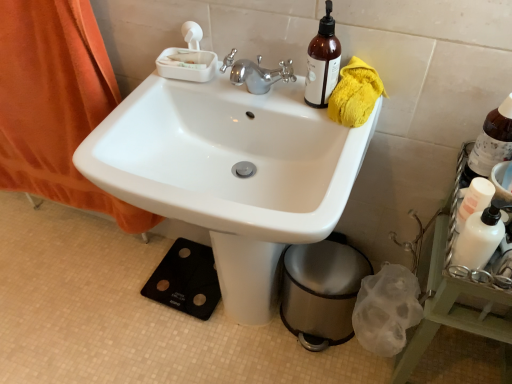
The height and width of the screenshot is (384, 512). What are the coordinates of `brown glass bottle at upper right, marked as the third bottle in a right-to-left arrangement` in the screenshot? It's located at (323, 62).

The height and width of the screenshot is (384, 512). Identify the location of orange fabric curtain at left. (56, 104).

Describe the element at coordinates (474, 200) in the screenshot. The height and width of the screenshot is (384, 512). I see `white glossy lotion at right, the second bottle positioned from the right` at that location.

I want to click on white glossy lotion at right, marked as the third bottle in a top-to-bottom arrangement, so 474,200.

Where is `brown glass bottle at upper right, which is the first bottle in left-to-right order`? brown glass bottle at upper right, which is the first bottle in left-to-right order is located at coordinates (323, 62).

From the brown glass bottle at upper right, the first bottle in the top-to-bottom sequence, count 2nd bottles forward and point to it. Please provide its 2D coordinates.

[(474, 200)]

Can you tell me how much brown glass bottle at upper right, marked as the third bottle in a right-to-left arrangement, and white glossy lotion at right, which is the second bottle in left-to-right order, differ in facing direction?

The facing directions of brown glass bottle at upper right, marked as the third bottle in a right-to-left arrangement, and white glossy lotion at right, which is the second bottle in left-to-right order, are 93.9 degrees apart.

Considering the positions of point (319, 62) and point (473, 193), is point (319, 62) closer or farther from the camera than point (473, 193)?

Point (319, 62).

Looking at this image, from a real-world perspective, which object rests below the other?

white glossy lotion at right, the second bottle positioned from the right, is physically lower.

Considering the relative sizes of brown glass bottle at upper right, which is counted as the third bottle, starting from the bottom, and white glossy sink at center in the image provided, is brown glass bottle at upper right, which is counted as the third bottle, starting from the bottom, bigger than white glossy sink at center?

Incorrect, brown glass bottle at upper right, which is counted as the third bottle, starting from the bottom, is not larger than white glossy sink at center.

In order to click on sink lying in front of the brown glass bottle at upper right, which is the first bottle in left-to-right order in this screenshot , I will do `click(231, 173)`.

From the picture: Visually, is brown glass bottle at upper right, marked as the third bottle in a right-to-left arrangement, positioned to the left or to the right of white glossy sink at center?

brown glass bottle at upper right, marked as the third bottle in a right-to-left arrangement, is to the right of white glossy sink at center.

Which of these two, brown glass bottle at upper right, the first bottle in the top-to-bottom sequence, or white glossy sink at center, stands shorter?

brown glass bottle at upper right, the first bottle in the top-to-bottom sequence, is shorter.

Is point (248, 143) more distant than point (313, 315)?

No, it is not.

From the image's perspective, which is above, white glossy sink at center or metallic trash can at lower right?

white glossy sink at center appears higher in the image.

From a real-world perspective, which is physically below, white glossy sink at center or metallic trash can at lower right?

metallic trash can at lower right is physically lower.

Is brown glass bottle at upper right, marked as the 3th bottle in a left-to-right arrangement, at the back of white glossy lotion at right, which is the second bottle in left-to-right order?

No, white glossy lotion at right, which is the second bottle in left-to-right order,'s orientation is not away from brown glass bottle at upper right, marked as the 3th bottle in a left-to-right arrangement.

Which is farther, (465, 196) or (468, 181)?

The point (468, 181) is farther from the camera.

Which is behind, white glossy lotion at right, which is the second bottle in left-to-right order, or brown glass bottle at upper right, which is the 1th bottle in right-to-left order?

Positioned behind is brown glass bottle at upper right, which is the 1th bottle in right-to-left order.

Can you confirm if white glossy lotion at right, which is counted as the first bottle, starting from the bottom, is positioned to the left of brown glass bottle at upper right, placed as the second bottle when sorted from top to bottom?

Yes.

From the image's perspective, between brown glass bottle at upper right, the first bottle in the top-to-bottom sequence, and orange fabric curtain at left, who is located below?

orange fabric curtain at left, from the image's perspective.

In the scene shown: Is orange fabric curtain at left at the back of brown glass bottle at upper right, the first bottle in the top-to-bottom sequence?

brown glass bottle at upper right, the first bottle in the top-to-bottom sequence, does not have its back to orange fabric curtain at left.

In the image, there is a brown glass bottle at upper right, which is the first bottle in left-to-right order. What are the coordinates of `curtain below it (from the image's perspective)` in the screenshot? It's located at (56, 104).

Is white glossy lotion at right, marked as the third bottle in a top-to-bottom arrangement, in front of or behind brown glass bottle at upper right, marked as the third bottle in a right-to-left arrangement, in the image?

white glossy lotion at right, marked as the third bottle in a top-to-bottom arrangement, is in front of brown glass bottle at upper right, marked as the third bottle in a right-to-left arrangement.

Would you say white glossy lotion at right, which is the second bottle in left-to-right order, is a long distance from brown glass bottle at upper right, which is the first bottle in left-to-right order?

white glossy lotion at right, which is the second bottle in left-to-right order, is actually quite close to brown glass bottle at upper right, which is the first bottle in left-to-right order.

Which object is positioned more to the left, white glossy lotion at right, the second bottle positioned from the right, or brown glass bottle at upper right, which is counted as the third bottle, starting from the bottom?

brown glass bottle at upper right, which is counted as the third bottle, starting from the bottom, is more to the left.

From the picture: Who is bigger, brown glass bottle at upper right, the second bottle in the bottom-to-top sequence, or white glossy lotion at right, which is the second bottle in left-to-right order?

Bigger between the two is brown glass bottle at upper right, the second bottle in the bottom-to-top sequence.

Is brown glass bottle at upper right, which is the 1th bottle in right-to-left order, wider than white glossy lotion at right, the second bottle positioned from the right?

Correct, the width of brown glass bottle at upper right, which is the 1th bottle in right-to-left order, exceeds that of white glossy lotion at right, the second bottle positioned from the right.

Is point (509, 104) closer or farther from the camera than point (488, 199)?

Point (509, 104) is farther from the camera than point (488, 199).

You are a GUI agent. You are given a task and a screenshot of the screen. Output one action in this format:
    pyautogui.click(x=<x>, y=<y>)
    Task: Click on the bottle below the brown glass bottle at upper right, marked as the 3th bottle in a left-to-right arrangement (from a real-world perspective)
    The width and height of the screenshot is (512, 384).
    Given the screenshot: What is the action you would take?
    pyautogui.click(x=474, y=200)

In order to click on the 2nd bottle in front of the brown glass bottle at upper right, which is counted as the third bottle, starting from the bottom in this screenshot , I will do `click(474, 200)`.

Identify the location of sink below the brown glass bottle at upper right, the first bottle in the top-to-bottom sequence (from a real-world perspective). Image resolution: width=512 pixels, height=384 pixels. (231, 173).

Based on their spatial positions, is white glossy lotion at right, the second bottle positioned from the right, or white matte bottle at right closer to brown glass bottle at upper right, which is the 1th bottle in right-to-left order?

The object closer to brown glass bottle at upper right, which is the 1th bottle in right-to-left order, is white glossy lotion at right, the second bottle positioned from the right.

When comparing their distances from brown glass bottle at upper right, which is the 1th bottle in right-to-left order, does brown glass bottle at upper right, which is counted as the third bottle, starting from the bottom, or orange fabric curtain at left seem further?

Among the two, orange fabric curtain at left is located further to brown glass bottle at upper right, which is the 1th bottle in right-to-left order.

In the scene shown: Which object lies further to the anchor point metallic trash can at lower right, brown glass bottle at upper right, which is the first bottle in left-to-right order, or white glossy lotion at right, which is the second bottle in left-to-right order?

The object further to metallic trash can at lower right is brown glass bottle at upper right, which is the first bottle in left-to-right order.

When comparing their distances from metallic trash can at lower right, does white matte bottle at right or orange fabric curtain at left seem further?

orange fabric curtain at left.

When comparing their distances from metallic trash can at lower right, does white matte bottle at right or white glossy lotion at right, which is counted as the first bottle, starting from the bottom, seem closer?

Based on the image, white matte bottle at right appears to be nearer to metallic trash can at lower right.

Based on their spatial positions, is metallic trash can at lower right or brown glass bottle at upper right, placed as the second bottle when sorted from top to bottom, further from brown glass bottle at upper right, the first bottle in the top-to-bottom sequence?

metallic trash can at lower right is positioned further to the anchor brown glass bottle at upper right, the first bottle in the top-to-bottom sequence.

From the image, which object appears to be farther from brown glass bottle at upper right, which is the first bottle in left-to-right order, orange fabric curtain at left or white matte bottle at right?

Among the two, orange fabric curtain at left is located further to brown glass bottle at upper right, which is the first bottle in left-to-right order.

Which object lies nearer to the anchor point brown glass bottle at upper right, which is the 1th bottle in right-to-left order, brown glass bottle at upper right, which is counted as the third bottle, starting from the bottom, or metallic trash can at lower right?

brown glass bottle at upper right, which is counted as the third bottle, starting from the bottom, is positioned closer to the anchor brown glass bottle at upper right, which is the 1th bottle in right-to-left order.

I want to click on bottle situated between orange fabric curtain at left and white matte bottle at right from left to right, so pyautogui.click(x=323, y=62).

I want to click on bottle that lies between brown glass bottle at upper right, the second bottle in the bottom-to-top sequence, and white matte bottle at right from top to bottom, so click(x=474, y=200).

Locate an element on the screen. Image resolution: width=512 pixels, height=384 pixels. bottle between brown glass bottle at upper right, marked as the third bottle in a right-to-left arrangement, and brown glass bottle at upper right, placed as the second bottle when sorted from top to bottom, from left to right is located at coordinates (474, 200).

This screenshot has width=512, height=384. I want to click on trash bin/can between white glossy sink at center and brown glass bottle at upper right, which is the 1th bottle in right-to-left order, from left to right, so click(x=322, y=290).